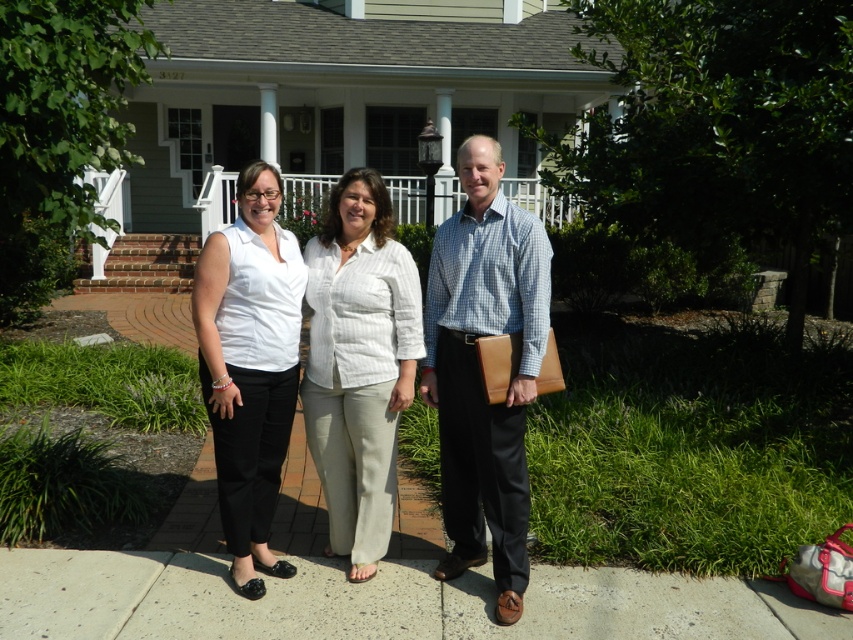
Is white cotton shirt at center shorter than blue checkered shirt at center?

Incorrect, white cotton shirt at center's height does not fall short of blue checkered shirt at center's.

Does point (491, 230) lie in front of point (512, 248)?

No, (491, 230) is behind (512, 248).

Locate an element on the screen. white cotton shirt at center is located at coordinates (480, 372).

Is white cotton shirt at center to the right of white textured pants at center from the viewer's perspective?

Yes, white cotton shirt at center is to the right of white textured pants at center.

Is white cotton shirt at center below white textured pants at center?

Correct, white cotton shirt at center is located below white textured pants at center.

What do you see at coordinates (480, 372) in the screenshot? The height and width of the screenshot is (640, 853). I see `white cotton shirt at center` at bounding box center [480, 372].

Identify the location of white cotton shirt at center. The width and height of the screenshot is (853, 640). (480, 372).

Does concrete at center have a lesser width compared to matte white blouse at center?

In fact, concrete at center might be wider than matte white blouse at center.

Is point (15, 618) positioned behind point (209, 340)?

No.

Between point (120, 612) and point (265, 467), which one is positioned in front?

Point (120, 612)

The width and height of the screenshot is (853, 640). I want to click on concrete at center, so click(380, 602).